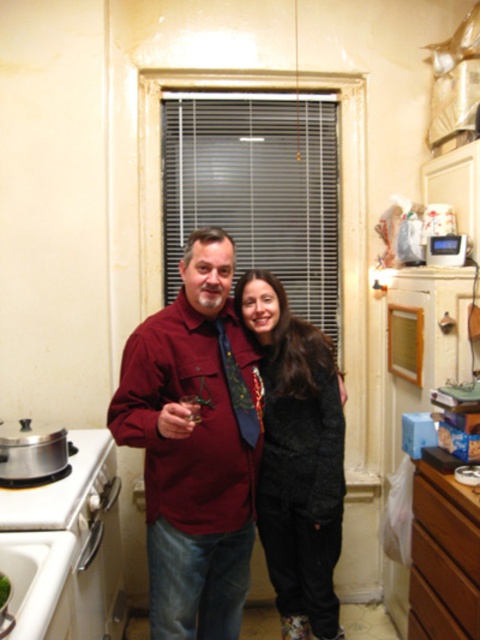
Question: Among these objects, which one is farthest from the camera?

Choices:
 (A) black fuzzy coat at center
 (B) brown wood drawer at lower right
 (C) maroon fabric shirt at center

Answer: (A)

Question: Does maroon fabric shirt at center have a lesser width compared to black fuzzy coat at center?

Choices:
 (A) yes
 (B) no

Answer: (B)

Question: Which object is the closest to the maroon fabric shirt at center?

Choices:
 (A) black fuzzy coat at center
 (B) brown wood drawer at lower right

Answer: (A)

Question: Among these points, which one is nearest to the camera?

Choices:
 (A) (195, 515)
 (B) (419, 572)

Answer: (A)

Question: Can you confirm if maroon fabric shirt at center is positioned to the right of brown wood drawer at lower right?

Choices:
 (A) yes
 (B) no

Answer: (B)

Question: Considering the relative positions of black fuzzy coat at center and brown wood drawer at lower right in the image provided, where is black fuzzy coat at center located with respect to brown wood drawer at lower right?

Choices:
 (A) left
 (B) right

Answer: (A)